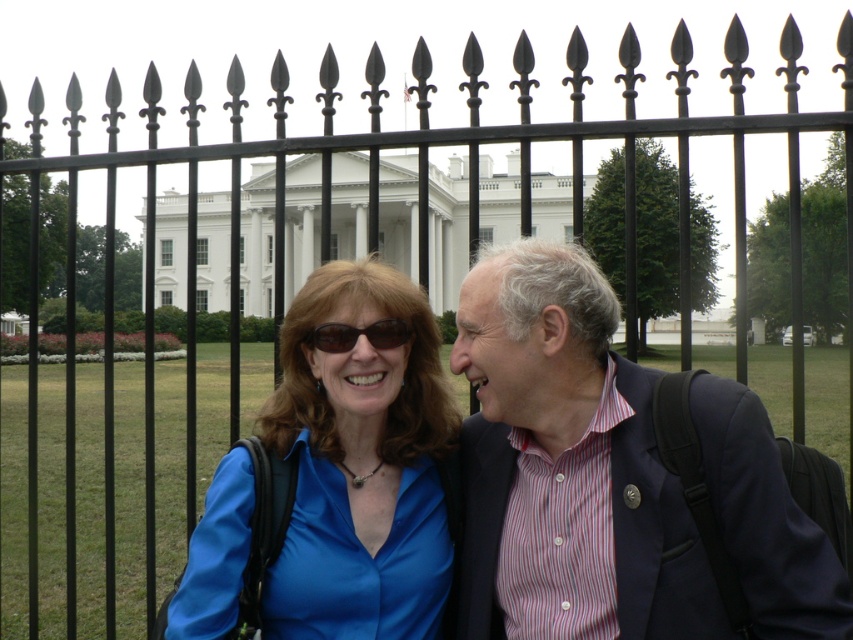
Question: Which point is closer to the camera?

Choices:
 (A) striped cotton shirt at center
 (B) blue satin blouse at center
 (C) matte black sunglasses at center

Answer: (A)

Question: Does striped cotton shirt at center appear over matte black sunglasses at center?

Choices:
 (A) no
 (B) yes

Answer: (A)

Question: Which point is farther to the camera?

Choices:
 (A) (384, 340)
 (B) (595, 568)
 (C) (306, 369)

Answer: (C)

Question: Is striped cotton shirt at center closer to the viewer compared to matte black sunglasses at center?

Choices:
 (A) no
 (B) yes

Answer: (B)

Question: Which is farther from the blue satin blouse at center?

Choices:
 (A) striped cotton shirt at center
 (B) matte black sunglasses at center

Answer: (A)

Question: Where is blue satin blouse at center located in relation to matte black sunglasses at center in the image?

Choices:
 (A) above
 (B) below

Answer: (B)